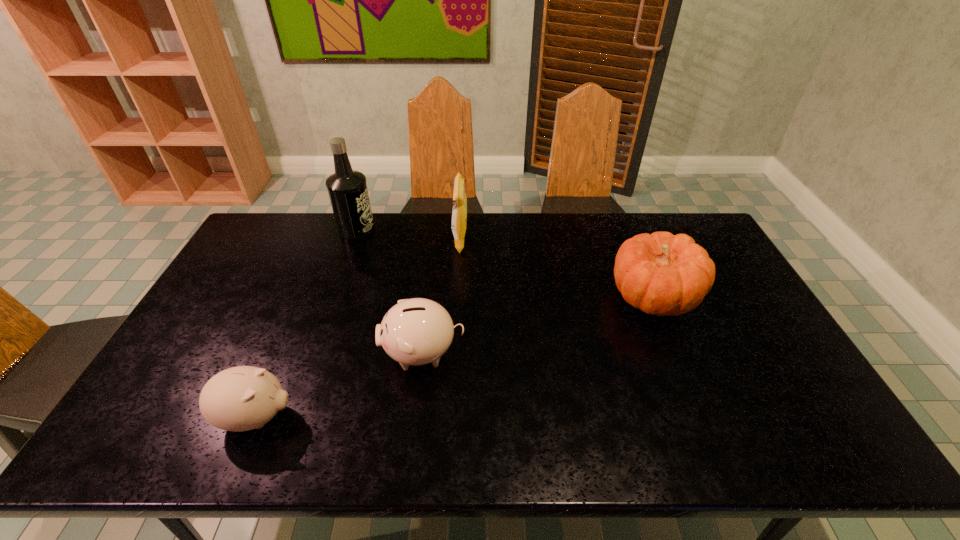
Find the location of `vacant space located at the snout of the left piggy bank`. vacant space located at the snout of the left piggy bank is located at coordinates (417, 417).

Where is `liquor at the far edge`? liquor at the far edge is located at coordinates click(347, 188).

The height and width of the screenshot is (540, 960). Find the location of `crisp (potato chip) that is at the far edge`. crisp (potato chip) that is at the far edge is located at coordinates (459, 213).

I want to click on object at the near edge, so click(x=242, y=398).

I want to click on object present at the right edge, so click(x=662, y=274).

This screenshot has height=540, width=960. I want to click on vacant region at the far edge of the desktop, so click(x=618, y=214).

Where is `blank space at the left edge of the desktop`? The image size is (960, 540). blank space at the left edge of the desktop is located at coordinates (250, 253).

Find the location of a particular element. The image size is (960, 540). vacant point at the right edge is located at coordinates (731, 296).

The width and height of the screenshot is (960, 540). I want to click on vacant area at the far left corner of the desktop, so click(267, 250).

In the image, there is a desktop. In order to click on vacant space at the far right corner in this screenshot , I will do `click(701, 222)`.